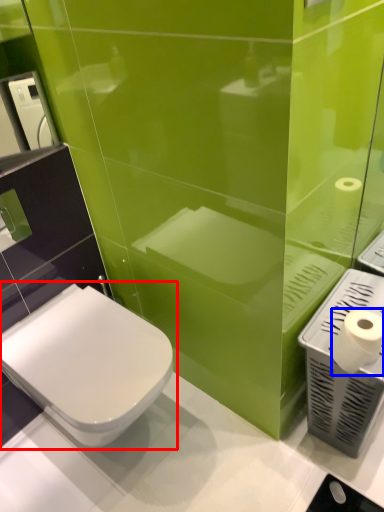
Question: Which object appears farthest to the camera in this image, toilet (highlighted by a red box) or toilet paper (highlighted by a blue box)?

Choices:
 (A) toilet
 (B) toilet paper

Answer: (A)